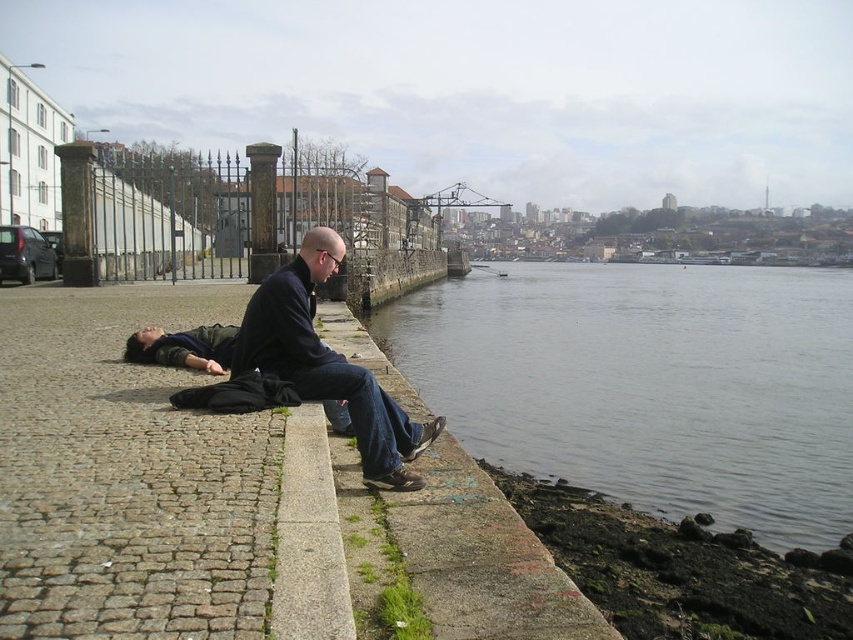
Does gray concrete waterway at lower center appear on the left side of smooth bald head at center?

Incorrect, gray concrete waterway at lower center is not on the left side of smooth bald head at center.

Does gray concrete waterway at lower center appear over smooth bald head at center?

Correct, gray concrete waterway at lower center is located above smooth bald head at center.

Identify the location of gray concrete waterway at lower center. (648, 385).

You are a GUI agent. You are given a task and a screenshot of the screen. Output one action in this format:
    pyautogui.click(x=<x>, y=<y>)
    Task: Click on the gray concrete waterway at lower center
    The image size is (853, 640).
    Given the screenshot: What is the action you would take?
    pyautogui.click(x=648, y=385)

Describe the element at coordinates (321, 252) in the screenshot. Image resolution: width=853 pixels, height=640 pixels. I see `smooth bald head at center` at that location.

Between point (314, 266) and point (148, 352), which one is positioned in front?

Point (314, 266)

Which is behind, point (334, 250) or point (135, 339)?

Positioned behind is point (135, 339).

Locate an element on the screen. smooth bald head at center is located at coordinates (321, 252).

Which is above, gray concrete curb at lower center or smooth bald head at center?

Positioned higher is smooth bald head at center.

Is point (320, 609) behind point (329, 240)?

No, (320, 609) is in front of (329, 240).

The height and width of the screenshot is (640, 853). I want to click on gray concrete curb at lower center, so click(x=308, y=538).